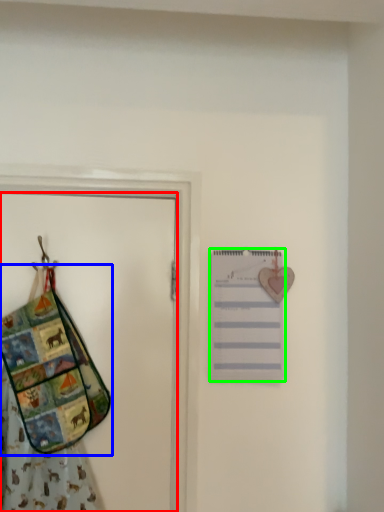
Question: Which object is the farthest from door (highlighted by a red box)? Choose among these: handbag (highlighted by a blue box) or list (highlighted by a green box).

Choices:
 (A) handbag
 (B) list

Answer: (B)